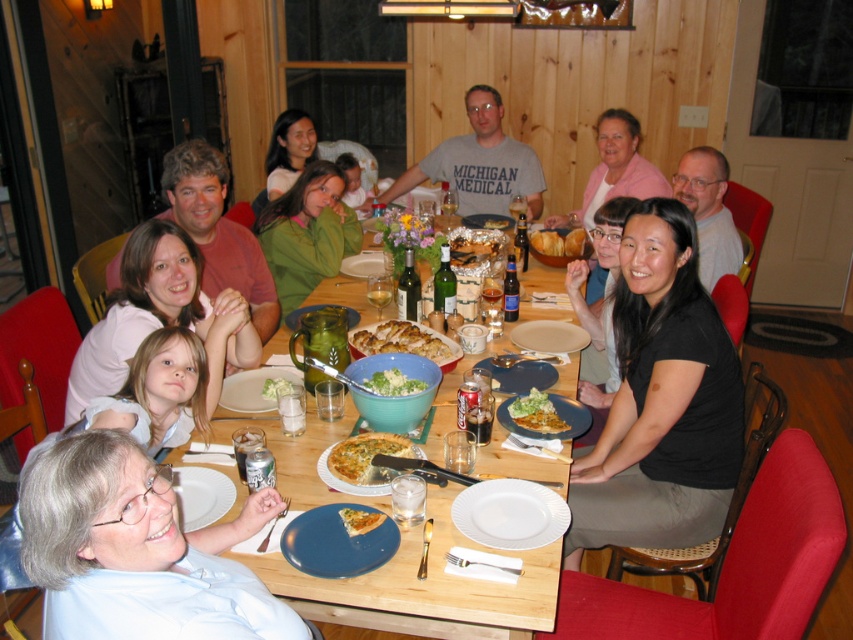
You are sitting at the wooden table at center and want to pass a dish to someone wearing the black matte shirt at center. In which direction should you pass the dish?

The black matte shirt at center is positioned on the right side of the wooden table at center, so you should pass the dish to the right side of the wooden table at center.

You are a server carrying a tray of drinks and need to navigate from the drinks station behind the dining table to the white matte plate at lower left without passing too close to the golden brown bread at center. The safety distance required is 2 meters. Can you safely reach the plate?

The distance between the white matte plate at lower left and the golden brown bread at center is 2.03 meters, which meets the required safety distance of 2 meters. Therefore, you can safely reach the white matte plate at lower left without violating the safety distance.

You are sitting at the dining table and want to pass a dish from one point to another. The points are labeled as point 1 at position (x=209, y=484) and point 2 at position (x=583, y=240). If you need to pass the dish from the point that is closer to you to the other, which point should you start from?

Since point 1 at position (x=209, y=484) is in front of point 2 at position (x=583, y=240), you should start passing the dish from point 1 at position (x=209, y=484) because it is closer to you.